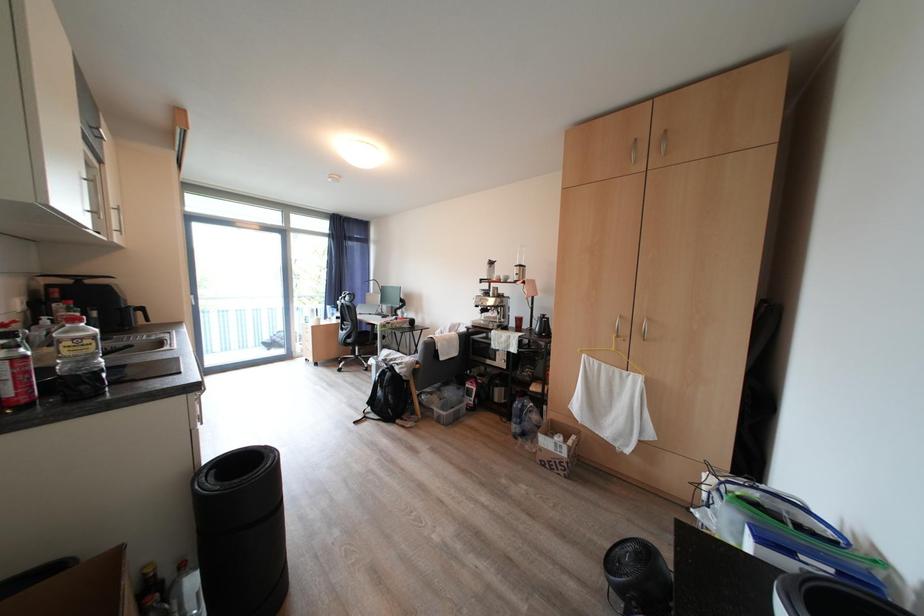
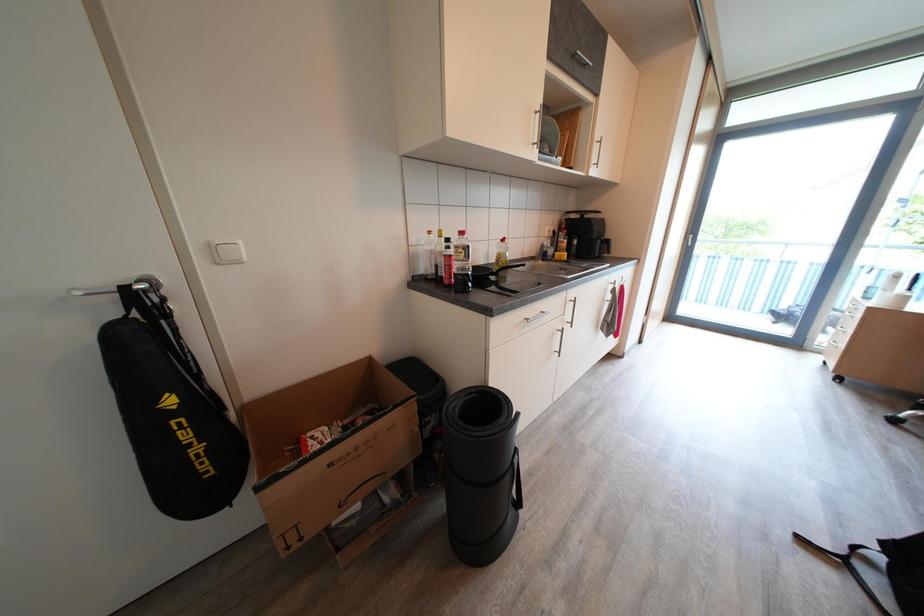
First-person continuous shooting, in which direction is the camera rotating?

The camera rotated toward left-down.